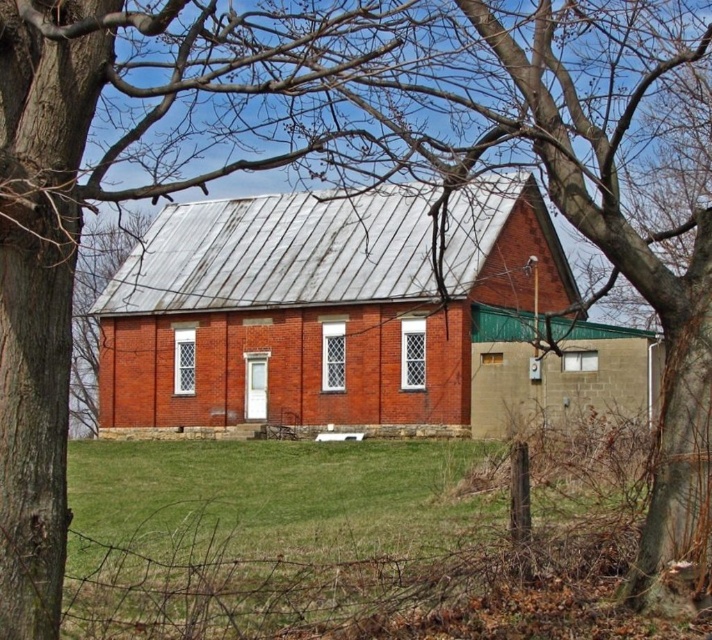
Between brick barn at center and green grass at center, which one is positioned lower?

green grass at center is lower down.

At what (x,y) coordinates should I click in order to perform the action: click on brick barn at center. Please return your answer as a coordinate pair (x, y). Looking at the image, I should click on (356, 317).

What do you see at coordinates (356, 317) in the screenshot?
I see `brick barn at center` at bounding box center [356, 317].

The height and width of the screenshot is (640, 712). What are the coordinates of `brick barn at center` in the screenshot? It's located at pyautogui.click(x=356, y=317).